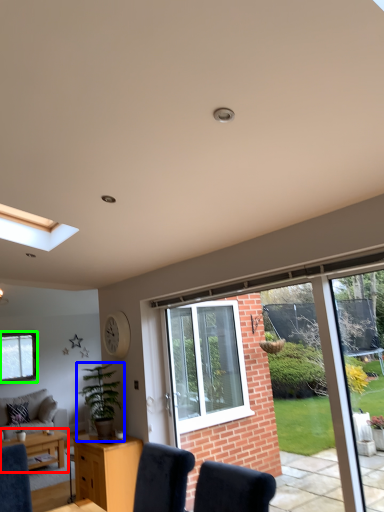
Question: Based on their relative distances, which object is nearer to table (highlighted by a red box)? Choose from houseplant (highlighted by a blue box) and window (highlighted by a green box).

Choices:
 (A) houseplant
 (B) window

Answer: (A)